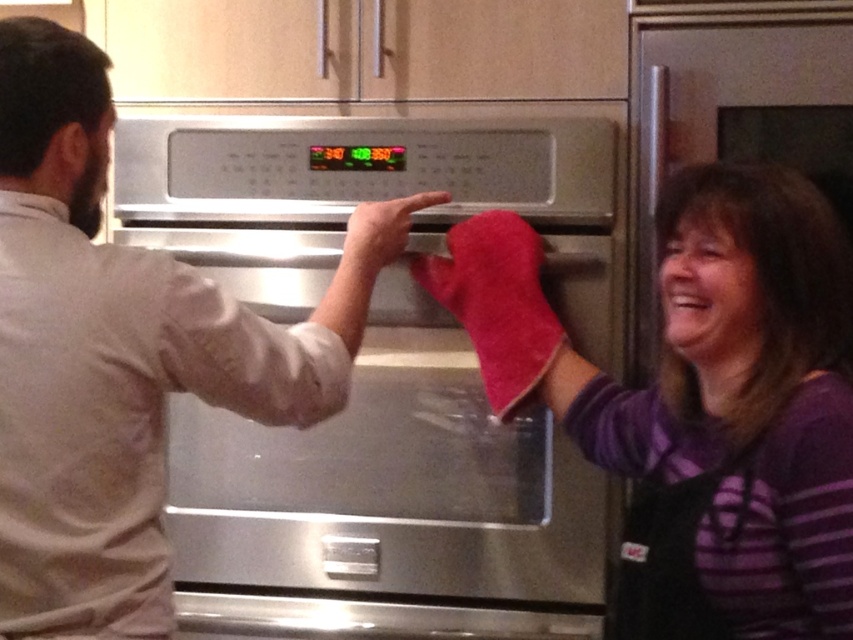
You are standing in the kitchen and want to reach both points. Which point, point (77, 186) or point (664, 186), would require you to stretch less to reach?

Point (77, 186) is closer to the viewer than point (664, 186), so you would need to stretch less to reach point (77, 186).

You are in a kitchen where there are a stainless steel oven at center and a red cotton oven mitt at center. Which object is closer to the person on the right wearing a purple striped shirt and black apron?

The red cotton oven mitt at center is closer to the person on the right wearing a purple striped shirt and black apron because the stainless steel oven at center is to the left of it.

You are in a kitchen and need to retrieve a baking sheet from the stainless steel oven at center. The matte white shirt at left is blocking your path. Can you move around the oven to access it?

The stainless steel oven at center is located below the matte white shirt at left, so you can move around the oven to access it as the shirt is above the oven and not directly blocking the front.